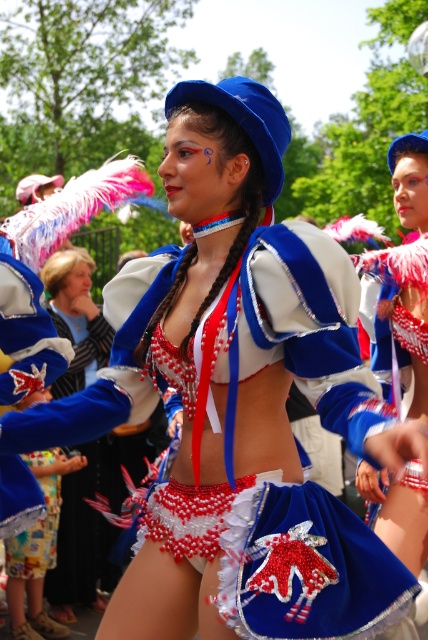
You are a costume designer trying to decide between the velvet blue skirt at center and the velvet blue shorts at center for a performance. Which one would you choose if you want the garment with the narrower silhouette?

The velvet blue skirt at center has a lesser width compared to the velvet blue shorts at center, so it would be the better choice for a narrower silhouette.